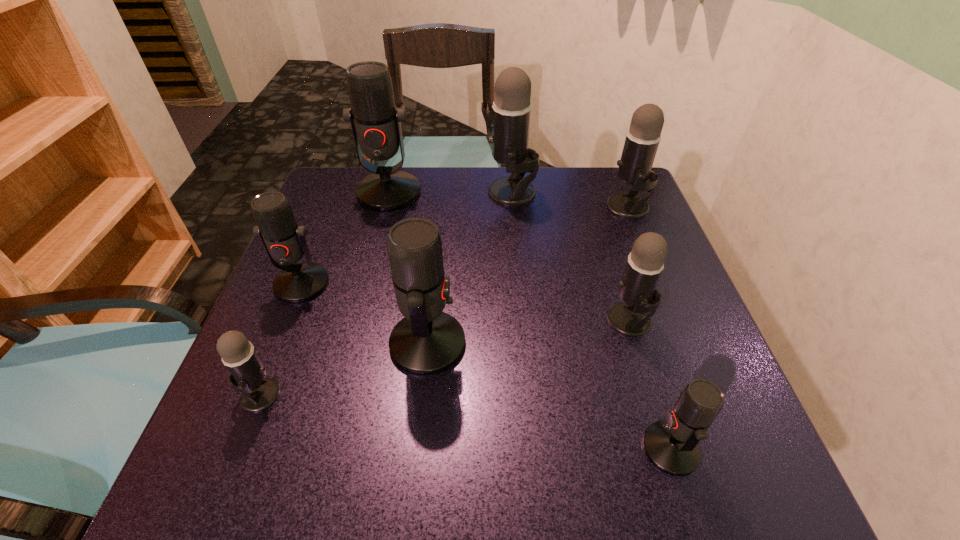
The width and height of the screenshot is (960, 540). I want to click on free space located on the side of the rightmost red microphone with the red ring, so click(x=394, y=448).

At what (x,y) coordinates should I click in order to perform the action: click on object that is at the near edge. Please return your answer as a coordinate pair (x, y). Looking at the image, I should click on (672, 446).

You are a GUI agent. You are given a task and a screenshot of the screen. Output one action in this format:
    pyautogui.click(x=<x>, y=<y>)
    Task: Click on the object that is at the far left corner
    This screenshot has width=960, height=540.
    Given the screenshot: What is the action you would take?
    (376, 124)

The width and height of the screenshot is (960, 540). Find the location of `object that is at the far right corner`. object that is at the far right corner is located at coordinates (642, 140).

Image resolution: width=960 pixels, height=540 pixels. I want to click on object present at the near right corner, so click(x=672, y=446).

At what (x,y) coordinates should I click in order to perform the action: click on free space at the far edge of the desktop. Please return your answer as a coordinate pair (x, y). Looking at the image, I should click on (498, 173).

Identify the location of free space at the near edge. Image resolution: width=960 pixels, height=540 pixels. (555, 495).

In the image, there is a desktop. At what (x,y) coordinates should I click in order to perform the action: click on vacant space at the left edge. Please return your answer as a coordinate pair (x, y). Looking at the image, I should click on (341, 267).

Identify the location of vacant space at the right edge of the desktop. tap(707, 372).

In the image, there is a desktop. At what (x,y) coordinates should I click in order to perform the action: click on vacant area at the far left corner. Please return your answer as a coordinate pair (x, y). The width and height of the screenshot is (960, 540). Looking at the image, I should click on (314, 211).